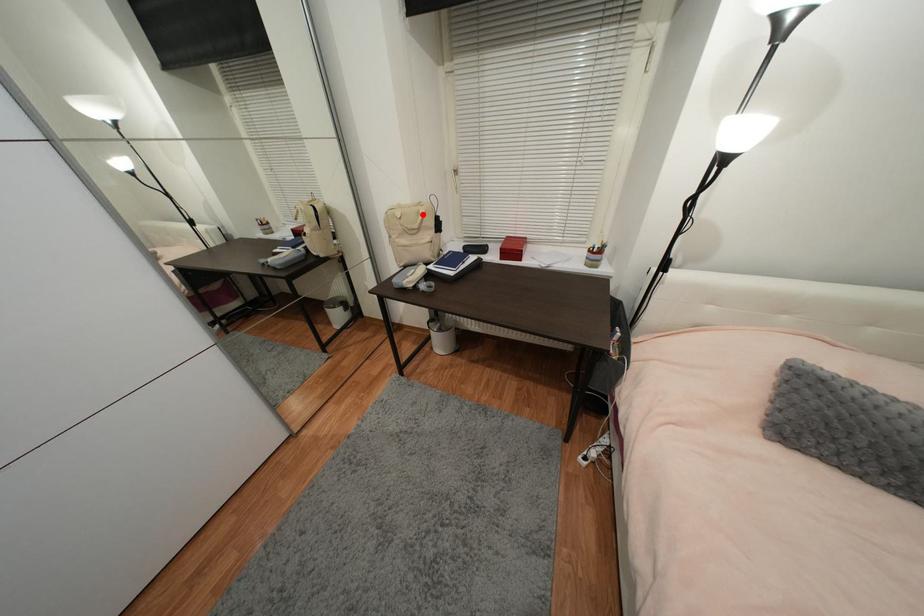
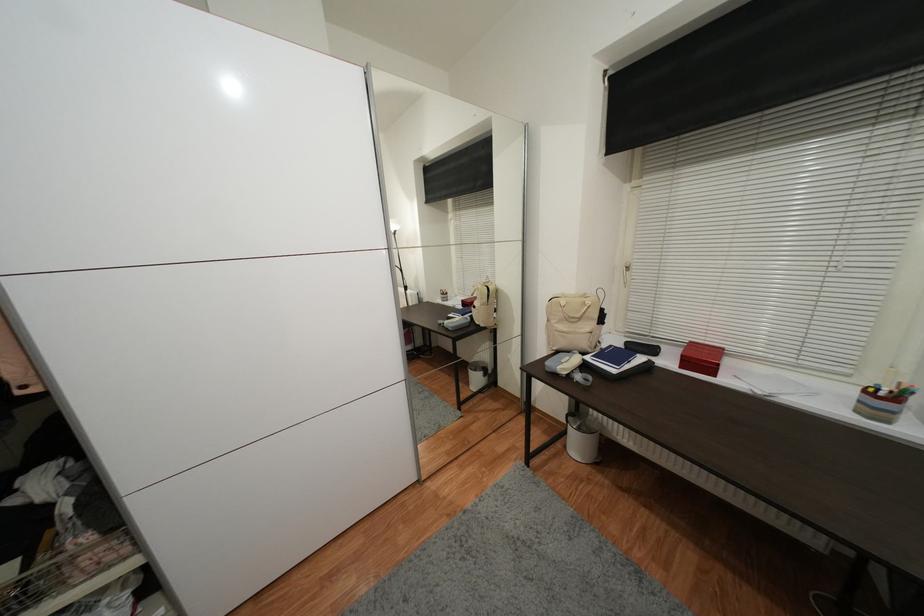
Question: A red point is marked in image1. In image2, is the corresponding 3D point closer to the camera or farther? Reply with the corresponding letter.

Choices:
 (A) The corresponding 3D point is closer.
 (B) The corresponding 3D point is farther.

Answer: (B)